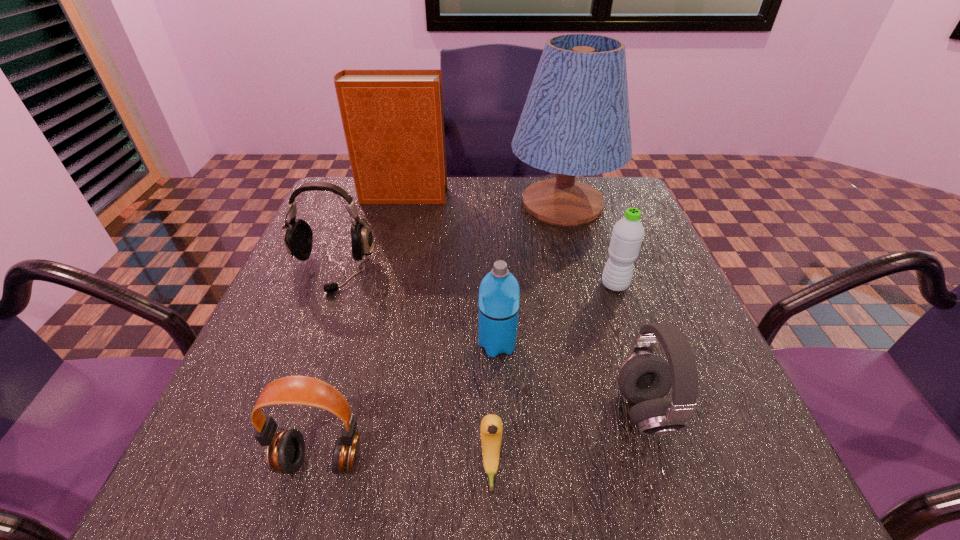
Find the location of `lampshade`. lampshade is located at coordinates (575, 122).

Where is `hardback book`? The image size is (960, 540). hardback book is located at coordinates (393, 120).

Find the location of a particular element. The width and height of the screenshot is (960, 540). the farthest headset is located at coordinates (297, 234).

The width and height of the screenshot is (960, 540). In order to click on the fifth farthest object in this screenshot , I will do `click(499, 294)`.

The height and width of the screenshot is (540, 960). Identify the location of water bottle. (628, 232).

At what (x,y) coordinates should I click in order to perform the action: click on the rightmost headset. Please return your answer as a coordinate pair (x, y). The width and height of the screenshot is (960, 540). Looking at the image, I should click on (644, 379).

Image resolution: width=960 pixels, height=540 pixels. Find the location of `the shortest object`. the shortest object is located at coordinates (491, 425).

I want to click on vacant space located 0.210m on the left of the tallest object, so click(x=430, y=204).

Where is `blank space located on the open cover of the seventh shortest object`? The width and height of the screenshot is (960, 540). blank space located on the open cover of the seventh shortest object is located at coordinates (549, 196).

Image resolution: width=960 pixels, height=540 pixels. I want to click on free region located 0.090m with the microphone on the side of the farthest headset, so click(309, 328).